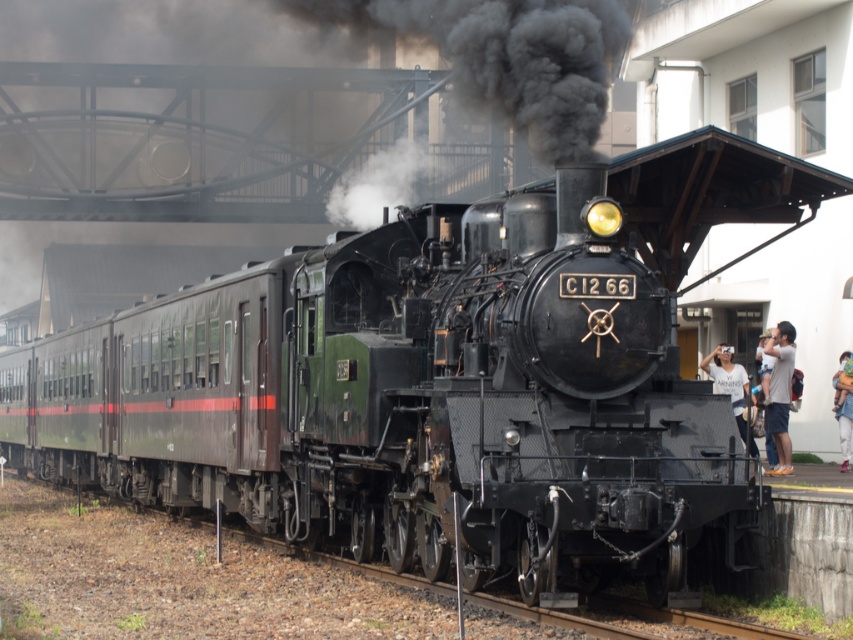
Question: Is light skin/white shirt at right bigger than light blue denim jeans at lower right?

Choices:
 (A) no
 (B) yes

Answer: (A)

Question: Which point is closer to the camera?

Choices:
 (A) white cotton shirt at center
 (B) light skin/white shirt at right
 (C) light blue denim jeans at lower right

Answer: (B)

Question: Which object is closer to the camera taking this photo?

Choices:
 (A) light blue denim jeans at lower right
 (B) light skin/white shirt at right

Answer: (B)

Question: Is white cotton shirt at center wider than light blue denim jeans at lower right?

Choices:
 (A) no
 (B) yes

Answer: (A)

Question: Considering the relative positions of light skin/white shirt at right and white cotton shirt at center in the image provided, where is light skin/white shirt at right located with respect to white cotton shirt at center?

Choices:
 (A) left
 (B) right

Answer: (B)

Question: Which of the following is the closest to the observer?

Choices:
 (A) (712, 364)
 (B) (779, 436)
 (C) (846, 355)

Answer: (B)